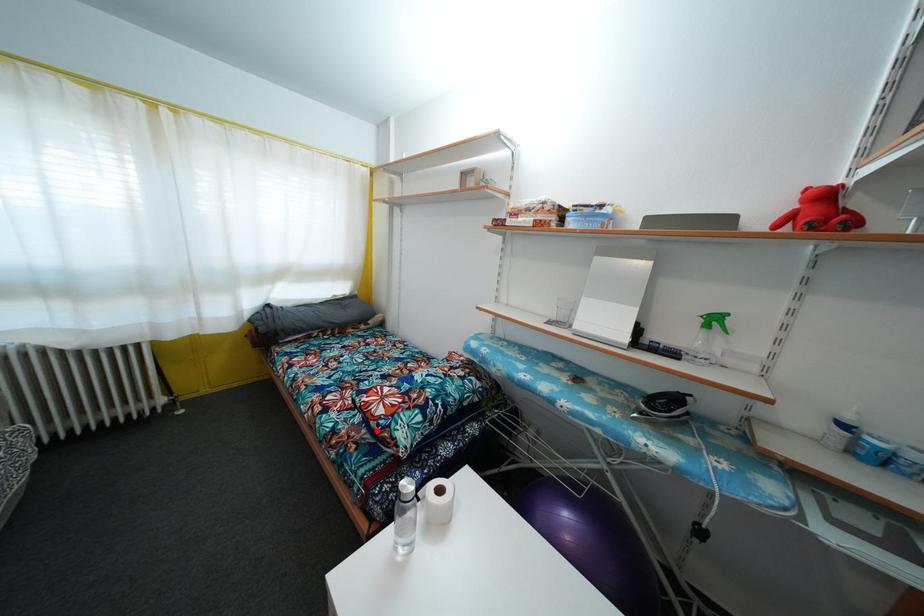
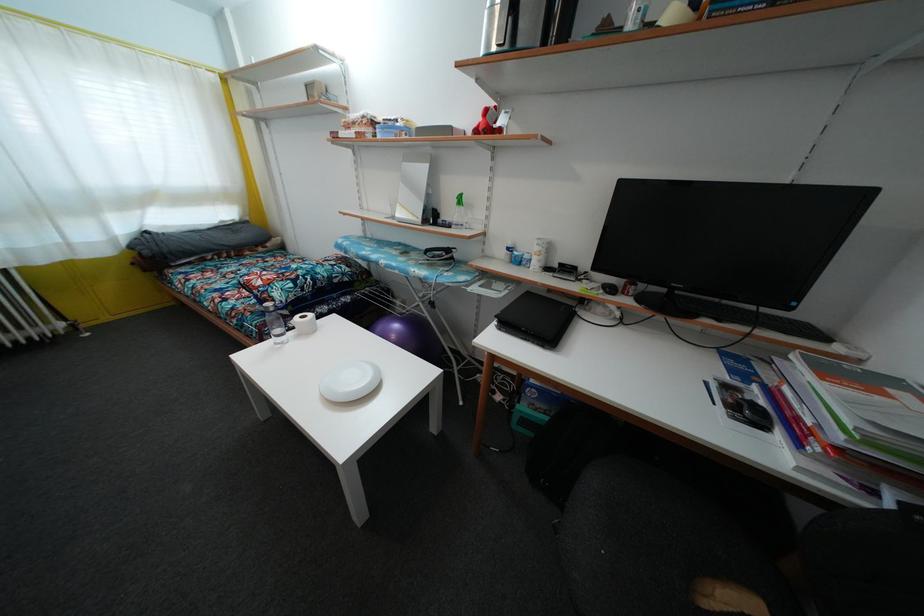
Question: I am providing you with two images of the same scene from different viewpoints. A red point is marked on the first image. Is the red point's position out of view in image 2?

Choices:
 (A) Yes
 (B) No

Answer: (B)